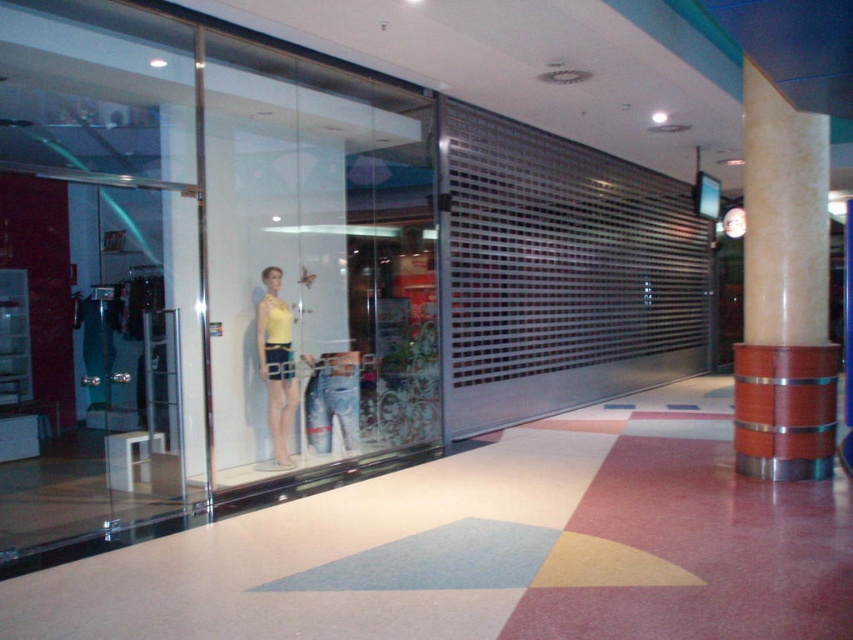
Between wooden column at right and matte yellow blouse at center, which one is positioned higher?

Positioned higher is wooden column at right.

In the scene shown: Which is more to the right, wooden column at right or matte yellow blouse at center?

wooden column at right is more to the right.

Who is more distant from viewer, (821, 218) or (271, 428)?

Point (271, 428)

Locate an element on the screen. Image resolution: width=853 pixels, height=640 pixels. wooden column at right is located at coordinates (784, 292).

Who is more distant from viewer, (358, 97) or (271, 362)?

The point (358, 97) is more distant.

Is transparent glass shop window at left smaller than matte yellow blouse at center?

Result: Correct, transparent glass shop window at left occupies less space than matte yellow blouse at center.

Is point (379, 196) farther from viewer compared to point (291, 408)?

That is True.

Locate an element on the screen. This screenshot has width=853, height=640. transparent glass shop window at left is located at coordinates (196, 275).

Can you confirm if transparent glass shop window at left is wider than wooden column at right?

No.

Looking at this image, who is positioned more to the left, transparent glass shop window at left or wooden column at right?

From the viewer's perspective, transparent glass shop window at left appears more on the left side.

Locate an element on the screen. The width and height of the screenshot is (853, 640). transparent glass shop window at left is located at coordinates (196, 275).

Locate an element on the screen. The height and width of the screenshot is (640, 853). transparent glass shop window at left is located at coordinates (196, 275).